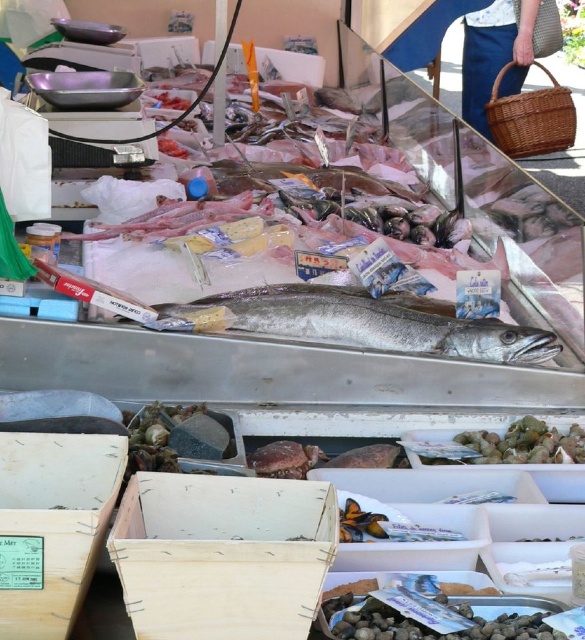
Is silver/glossy fish at center shorter than woven brown basket at upper right?

Indeed, silver/glossy fish at center has a lesser height compared to woven brown basket at upper right.

Who is positioned more to the left, silver/glossy fish at center or woven brown basket at upper right?

silver/glossy fish at center is more to the left.

Consider the image. Measure the distance between silver/glossy fish at center and camera.

silver/glossy fish at center and camera are 7.85 feet apart.

At what (x,y) coordinates should I click in order to perform the action: click on silver/glossy fish at center. Please return your answer as a coordinate pair (x, y). This screenshot has height=640, width=585. Looking at the image, I should click on (x=374, y=323).